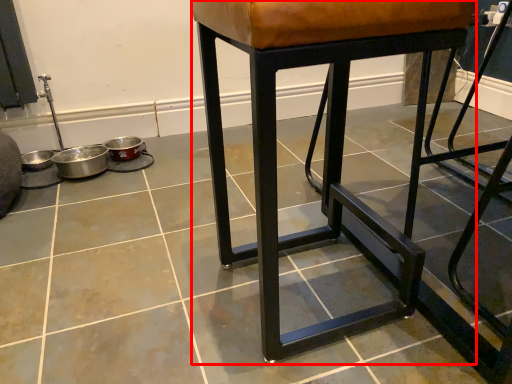
Question: From the image, what is the correct spatial relationship of stool (annotated by the red box) in relation to concrete?

Choices:
 (A) left
 (B) right

Answer: (B)